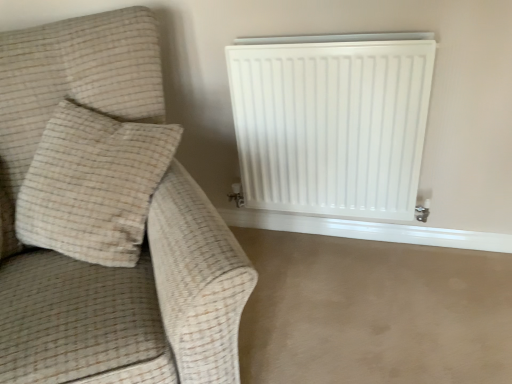
Question: From a real-world perspective, is beige textured pillow at left located higher than beige fabric couch at left?

Choices:
 (A) yes
 (B) no

Answer: (A)

Question: Considering the relative sizes of beige textured pillow at left and beige fabric couch at left in the image provided, is beige textured pillow at left wider than beige fabric couch at left?

Choices:
 (A) no
 (B) yes

Answer: (A)

Question: Is beige textured pillow at left turned away from beige fabric couch at left?

Choices:
 (A) no
 (B) yes

Answer: (B)

Question: Considering the relative sizes of beige textured pillow at left and beige fabric couch at left in the image provided, is beige textured pillow at left shorter than beige fabric couch at left?

Choices:
 (A) yes
 (B) no

Answer: (A)

Question: Considering the relative positions of beige textured pillow at left and beige fabric couch at left in the image provided, is beige textured pillow at left behind beige fabric couch at left?

Choices:
 (A) no
 (B) yes

Answer: (B)

Question: Is beige fabric couch at left spatially inside beige carpet at lower right, or outside of it?

Choices:
 (A) outside
 (B) inside

Answer: (A)

Question: From a real-world perspective, is beige fabric couch at left positioned above or below beige carpet at lower right?

Choices:
 (A) below
 (B) above

Answer: (B)

Question: Is point (164, 243) closer or farther from the camera than point (440, 301)?

Choices:
 (A) closer
 (B) farther

Answer: (A)

Question: From the image's perspective, is beige fabric couch at left located above or below beige carpet at lower right?

Choices:
 (A) above
 (B) below

Answer: (A)

Question: Is beige fabric couch at left spatially inside beige textured pillow at left, or outside of it?

Choices:
 (A) outside
 (B) inside

Answer: (A)

Question: Considering the positions of point 118,74 and point 98,243, is point 118,74 closer or farther from the camera than point 98,243?

Choices:
 (A) farther
 (B) closer

Answer: (A)

Question: Considering the positions of beige fabric couch at left and beige textured pillow at left in the image, is beige fabric couch at left taller or shorter than beige textured pillow at left?

Choices:
 (A) tall
 (B) short

Answer: (A)

Question: From the image's perspective, is beige fabric couch at left positioned above or below beige textured pillow at left?

Choices:
 (A) above
 (B) below

Answer: (B)

Question: In terms of size, does beige textured pillow at left appear bigger or smaller than beige fabric couch at left?

Choices:
 (A) small
 (B) big

Answer: (A)

Question: Considering the positions of point (163, 140) and point (7, 253), is point (163, 140) closer or farther from the camera than point (7, 253)?

Choices:
 (A) farther
 (B) closer

Answer: (B)